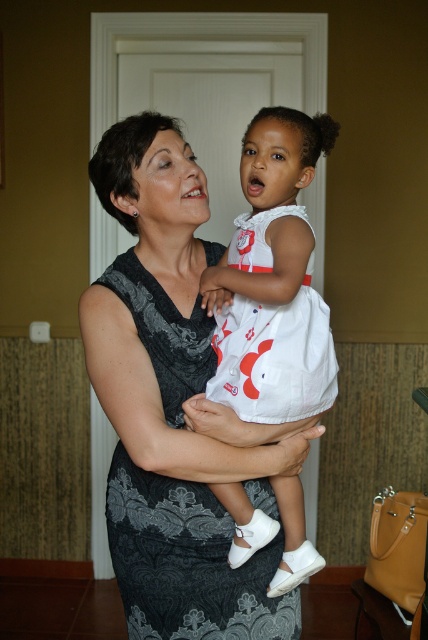
Question: Which of the following is the closest to the observer?

Choices:
 (A) pyautogui.click(x=124, y=252)
 (B) pyautogui.click(x=235, y=413)

Answer: (B)

Question: Is white satin dress at center smaller than black lace dress at center?

Choices:
 (A) no
 (B) yes

Answer: (B)

Question: Can you confirm if white satin dress at center is bigger than black lace dress at center?

Choices:
 (A) no
 (B) yes

Answer: (A)

Question: Is white satin dress at center to the right of black lace dress at center from the viewer's perspective?

Choices:
 (A) no
 (B) yes

Answer: (B)

Question: Which of the following is the farthest from the observer?

Choices:
 (A) black lace dress at center
 (B) white satin dress at center

Answer: (A)